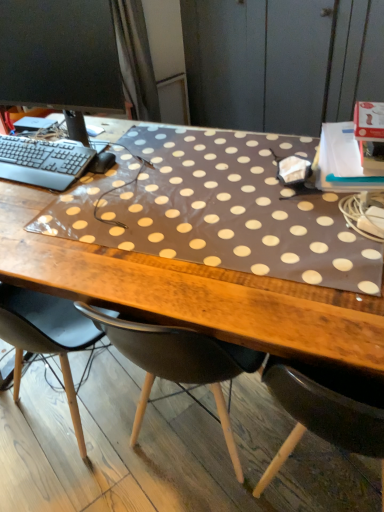
You are a GUI agent. You are given a task and a screenshot of the screen. Output one action in this format:
    pyautogui.click(x=<x>, y=<y>)
    Task: Click on the vacant region above brown polka dot mat at center (from a real-world perspective)
    The height and width of the screenshot is (512, 384).
    Given the screenshot: What is the action you would take?
    pyautogui.click(x=163, y=203)